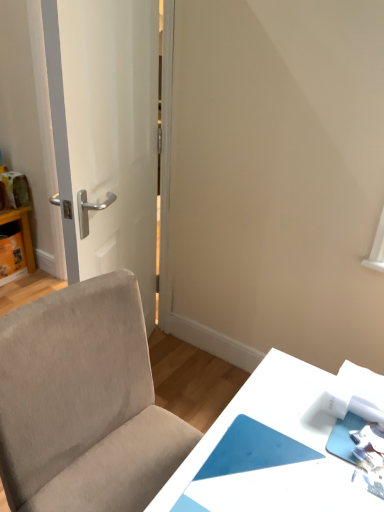
Question: Could you tell me if beige fabric chair at lower left is facing matte cardboard box at left, the first table in the left-to-right sequence?

Choices:
 (A) no
 (B) yes

Answer: (A)

Question: Considering the relative sizes of beige fabric chair at lower left and matte cardboard box at left, the first table in the left-to-right sequence, in the image provided, is beige fabric chair at lower left taller than matte cardboard box at left, the first table in the left-to-right sequence,?

Choices:
 (A) no
 (B) yes

Answer: (B)

Question: Is beige fabric chair at lower left completely or partially outside of matte cardboard box at left, which is the second table from right to left?

Choices:
 (A) yes
 (B) no

Answer: (A)

Question: Is the position of beige fabric chair at lower left more distant than that of matte cardboard box at left, the 2th table from the bottom?

Choices:
 (A) yes
 (B) no

Answer: (B)

Question: From a real-world perspective, is beige fabric chair at lower left located beneath matte cardboard box at left, which is the second table from right to left?

Choices:
 (A) yes
 (B) no

Answer: (B)

Question: Is white glossy door at left to the left or to the right of beige fabric chair at lower left in the image?

Choices:
 (A) right
 (B) left

Answer: (B)

Question: Is white glossy door at left bigger or smaller than beige fabric chair at lower left?

Choices:
 (A) big
 (B) small

Answer: (B)

Question: Looking at their shapes, would you say white glossy door at left is wider or thinner than beige fabric chair at lower left?

Choices:
 (A) thin
 (B) wide

Answer: (A)

Question: From their relative heights in the image, would you say white glossy door at left is taller or shorter than beige fabric chair at lower left?

Choices:
 (A) short
 (B) tall

Answer: (B)

Question: In the image, is matte cardboard box at left, which ranks as the second table in front-to-back order, positioned in front of or behind beige fabric chair at lower left?

Choices:
 (A) front
 (B) behind

Answer: (B)

Question: Do you think matte cardboard box at left, which ranks as the second table in front-to-back order, is within beige fabric chair at lower left, or outside of it?

Choices:
 (A) inside
 (B) outside

Answer: (B)

Question: From a real-world perspective, is matte cardboard box at left, which is the second table from right to left, positioned above or below beige fabric chair at lower left?

Choices:
 (A) below
 (B) above

Answer: (A)

Question: From the image's perspective, is matte cardboard box at left, the 2th table from the bottom, located above or below beige fabric chair at lower left?

Choices:
 (A) above
 (B) below

Answer: (A)

Question: From the image's perspective, is beige fabric chair at lower left positioned above or below matte cardboard box at left, the first table positioned from the top?

Choices:
 (A) below
 (B) above

Answer: (A)

Question: Is beige fabric chair at lower left bigger or smaller than matte cardboard box at left, which ranks as the second table in front-to-back order?

Choices:
 (A) small
 (B) big

Answer: (B)